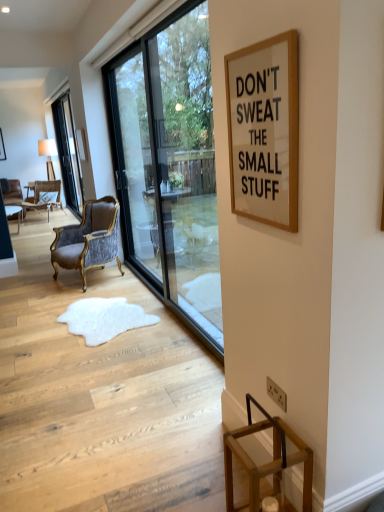
Question: Considering the relative positions of white paperboard at upper right and clear glass window at left, which is the first window from left to right, in the image provided, is white paperboard at upper right to the left of clear glass window at left, which is the first window from left to right, from the viewer's perspective?

Choices:
 (A) no
 (B) yes

Answer: (A)

Question: Is white paperboard at upper right at the right side of clear glass window at left, which is the first window from left to right?

Choices:
 (A) no
 (B) yes

Answer: (B)

Question: Does white paperboard at upper right come in front of clear glass window at left, which is counted as the 2th window, starting from the front?

Choices:
 (A) no
 (B) yes

Answer: (B)

Question: From a real-world perspective, is white paperboard at upper right physically above clear glass window at left, which is counted as the 2th window, starting from the front?

Choices:
 (A) no
 (B) yes

Answer: (B)

Question: Considering the relative sizes of white paperboard at upper right and clear glass window at left, which is counted as the 2th window, starting from the front, in the image provided, is white paperboard at upper right thinner than clear glass window at left, which is counted as the 2th window, starting from the front,?

Choices:
 (A) no
 (B) yes

Answer: (B)

Question: Is point (109, 318) positioned closer to the camera than point (34, 202)?

Choices:
 (A) farther
 (B) closer

Answer: (B)

Question: Is white fur rug at center spatially inside velvet upholstered chair at left, which is the 2th chair in bottom-to-top order, or outside of it?

Choices:
 (A) outside
 (B) inside

Answer: (A)

Question: From a real-world perspective, is white fur rug at center physically located above or below velvet upholstered chair at left, which is the 2th chair in bottom-to-top order?

Choices:
 (A) below
 (B) above

Answer: (A)

Question: Considering the positions of white fur rug at center and velvet upholstered chair at left, the second chair from the front, in the image, is white fur rug at center wider or thinner than velvet upholstered chair at left, the second chair from the front,?

Choices:
 (A) wide
 (B) thin

Answer: (A)

Question: Is velvet upholstered chair at left, which is the first chair in top-to-bottom order, in front of or behind transparent glass window at center, arranged as the 2th window when viewed from the back, in the image?

Choices:
 (A) front
 (B) behind

Answer: (B)

Question: In terms of width, does velvet upholstered chair at left, positioned as the 1th chair in back-to-front order, look wider or thinner when compared to transparent glass window at center, acting as the second window starting from the left?

Choices:
 (A) thin
 (B) wide

Answer: (B)

Question: Is point (36, 201) closer or farther from the camera than point (170, 150)?

Choices:
 (A) closer
 (B) farther

Answer: (B)

Question: Is velvet upholstered chair at left, placed as the first chair when sorted from left to right, taller or shorter than transparent glass window at center, which appears as the first window when viewed from the right?

Choices:
 (A) tall
 (B) short

Answer: (B)

Question: From the image's perspective, is wooden table at left positioned above or below transparent glass screen door at center?

Choices:
 (A) above
 (B) below

Answer: (B)

Question: In the image, is wooden table at left positioned in front of or behind transparent glass screen door at center?

Choices:
 (A) front
 (B) behind

Answer: (B)